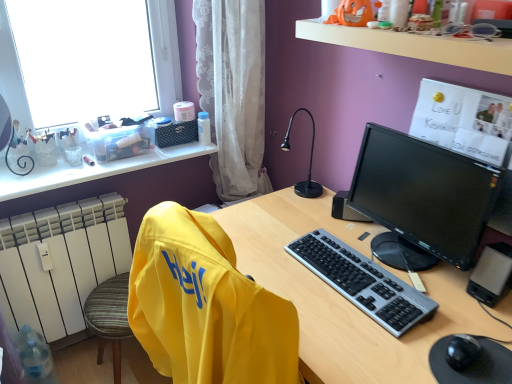
You are a GUI agent. You are given a task and a screenshot of the screen. Output one action in this format:
    pyautogui.click(x=<x>, y=<y>)
    Task: Click on the free space above matte plastic desk at center (from a real-world perspective)
    
    Given the screenshot: What is the action you would take?
    pyautogui.click(x=350, y=264)